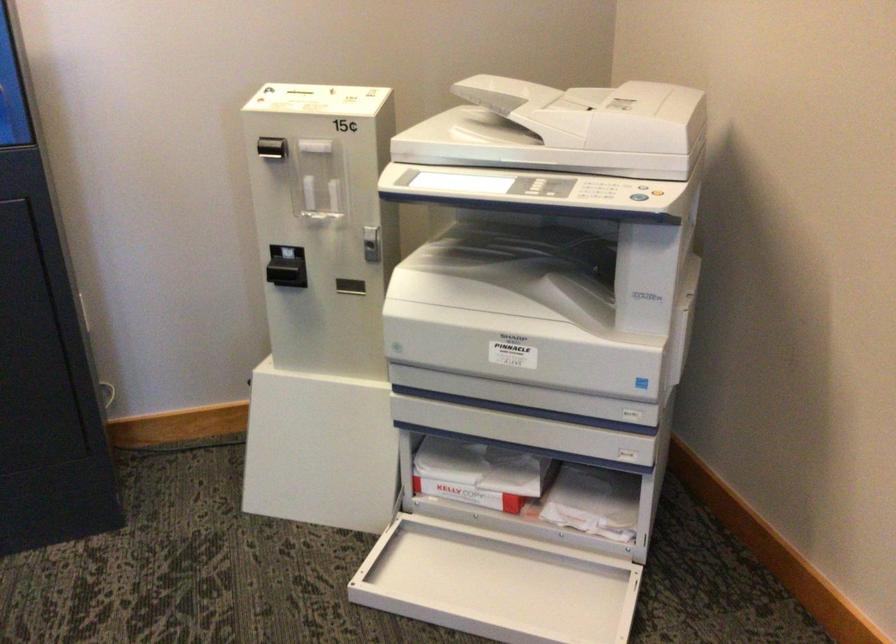
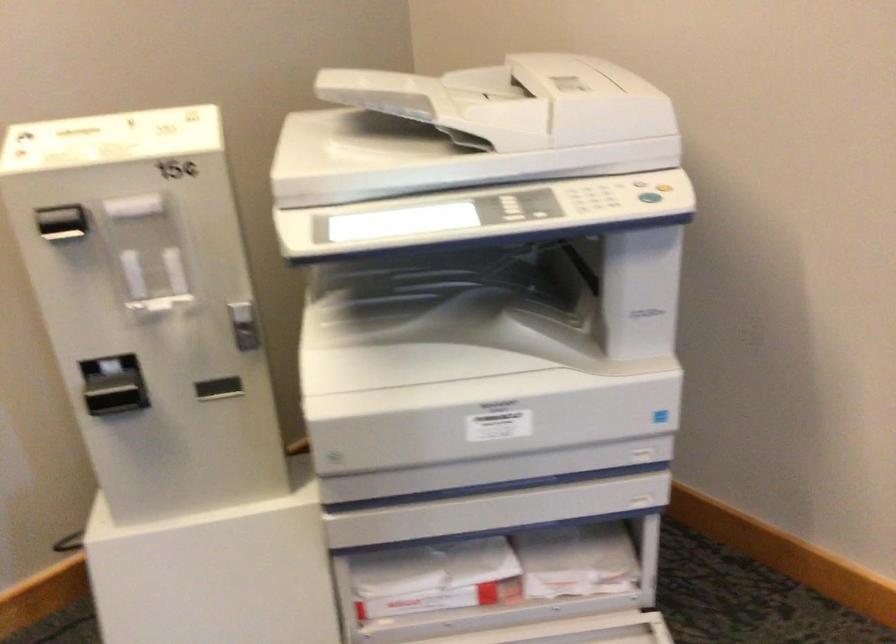
Which direction would the cameraman need to move to produce the second image?

The cameraman moved toward left, forward.